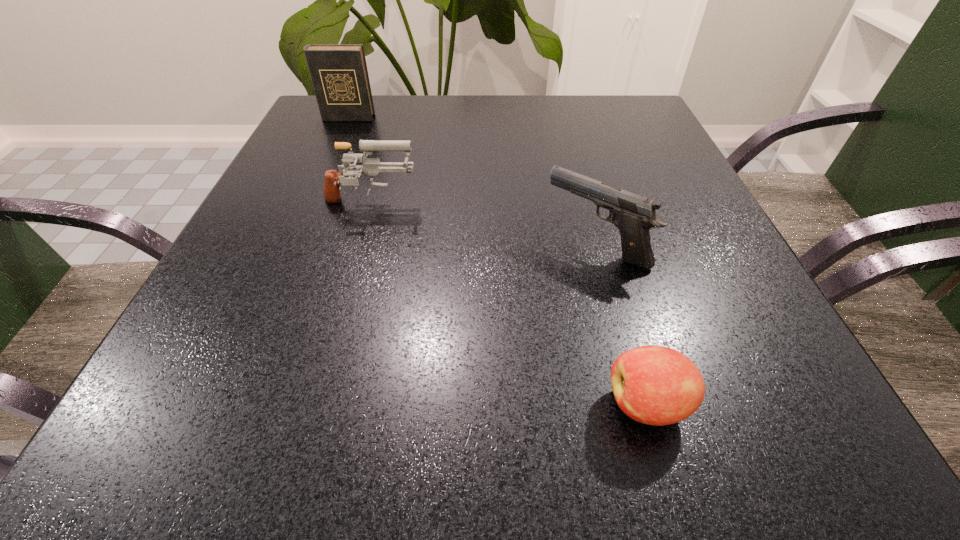
You are a GUI agent. You are given a task and a screenshot of the screen. Output one action in this format:
    pyautogui.click(x=<x>, y=<y>)
    Task: Click on the free region located 0.240m at the muzzle of the right gun
    
    Given the screenshot: What is the action you would take?
    click(x=405, y=245)

The image size is (960, 540). I want to click on blank space located on the back of the shortest object, so click(619, 307).

Find the location of `object that is at the far edge`. object that is at the far edge is located at coordinates (339, 74).

Locate an element on the screen. object located at the near edge is located at coordinates (655, 385).

Where is `diary positioned at the left edge`? diary positioned at the left edge is located at coordinates (339, 74).

Image resolution: width=960 pixels, height=540 pixels. I want to click on gun present at the left edge, so click(371, 166).

Locate an element on the screen. This screenshot has height=540, width=960. object that is at the right edge is located at coordinates (634, 215).

Image resolution: width=960 pixels, height=540 pixels. I want to click on object present at the far left corner, so click(339, 74).

At what (x,y) coordinates should I click in order to perform the action: click on vacant space at the far edge. Please return your answer as a coordinate pair (x, y). The height and width of the screenshot is (540, 960). Looking at the image, I should click on (491, 123).

The width and height of the screenshot is (960, 540). In the image, there is a desktop. In order to click on vacant space at the left edge in this screenshot , I will do `click(149, 386)`.